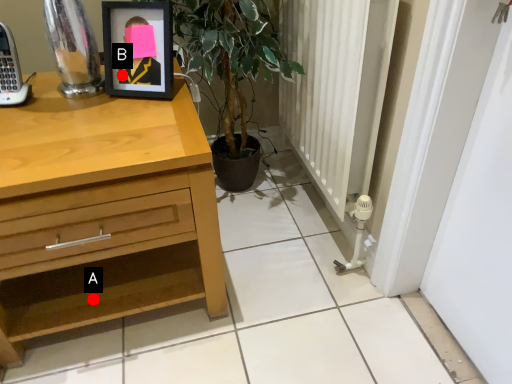
Question: Two points are circled on the image, labeled by A and B beside each circle. Which of the following is the farthest from the observer?

Choices:
 (A) A is further
 (B) B is further

Answer: (A)